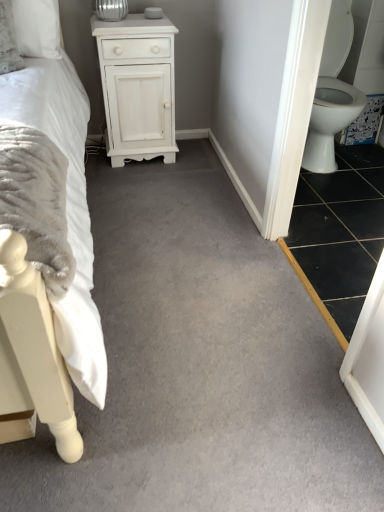
Find the location of `unoccupied region to the right of white matte cabinet at upper center`. unoccupied region to the right of white matte cabinet at upper center is located at coordinates (196, 165).